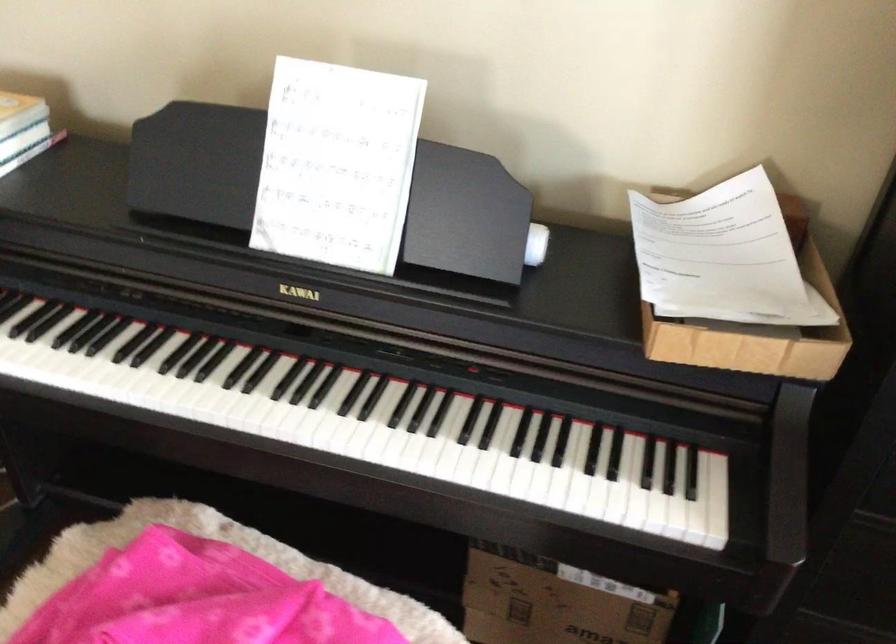
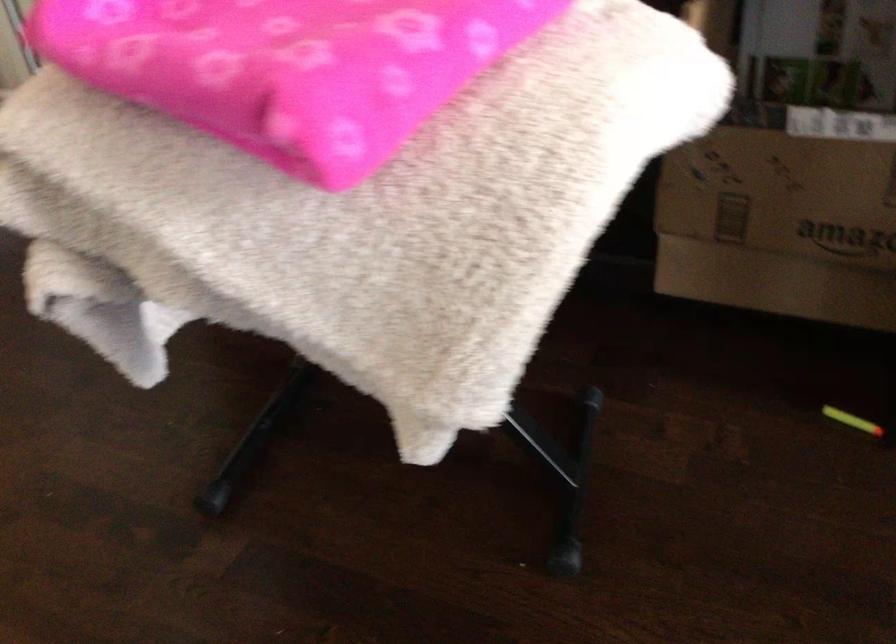
Question: The images are taken continuously from a first-person perspective. In which direction are you moving?

Choices:
 (A) Left
 (B) Right
 (C) Forward
 (D) Backward

Answer: (C)